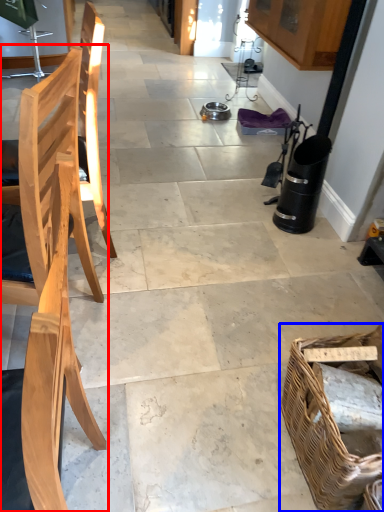
Question: Which object is closer to the camera taking this photo, chair (highlighted by a red box) or picnic basket (highlighted by a blue box)?

Choices:
 (A) chair
 (B) picnic basket

Answer: (A)